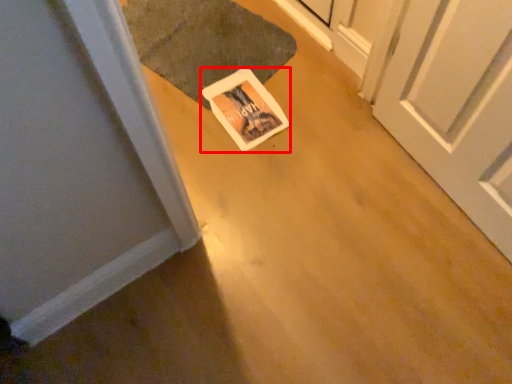
Question: Considering the relative positions of postcard (annotated by the red box) and doormat in the image provided, where is postcard (annotated by the red box) located with respect to the staircase?

Choices:
 (A) left
 (B) right

Answer: (B)